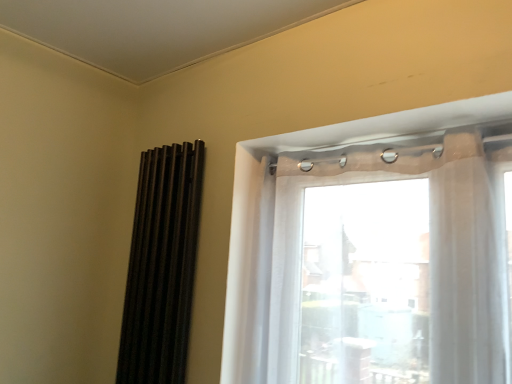
The image size is (512, 384). Describe the element at coordinates (389, 261) in the screenshot. I see `translucent fabric at upper right` at that location.

What are the coordinates of `translucent fabric at upper right` in the screenshot? It's located at (389, 261).

The image size is (512, 384). Describe the element at coordinates (162, 266) in the screenshot. I see `black matte shutters at left` at that location.

This screenshot has width=512, height=384. Identify the location of black matte shutters at left. (162, 266).

The image size is (512, 384). What are the coordinates of `translucent fabric at upper right` in the screenshot? It's located at (389, 261).

Can you confirm if translucent fabric at upper right is positioned to the right of black matte shutters at left?

Yes.

Relative to black matte shutters at left, is translucent fabric at upper right in front or behind?

translucent fabric at upper right is in front of black matte shutters at left.

Does point (280, 257) come in front of point (180, 215)?

Yes.

From the picture: From the image's perspective, who appears lower, translucent fabric at upper right or black matte shutters at left?

From the image's view, black matte shutters at left is below.

From a real-world perspective, is translucent fabric at upper right physically above black matte shutters at left?

Yes, from a real-world perspective, translucent fabric at upper right is on top of black matte shutters at left.

Which of these two, translucent fabric at upper right or black matte shutters at left, is wider?

Wider between the two is translucent fabric at upper right.

Does translucent fabric at upper right have a lesser height compared to black matte shutters at left?

Yes.

Considering the relative sizes of translucent fabric at upper right and black matte shutters at left in the image provided, is translucent fabric at upper right smaller than black matte shutters at left?

No.

Would you say translucent fabric at upper right contains black matte shutters at left?

No, black matte shutters at left is not inside translucent fabric at upper right.

Is translucent fabric at upper right far from black matte shutters at left?

translucent fabric at upper right is actually quite close to black matte shutters at left.

Is translucent fabric at upper right aimed at black matte shutters at left?

No, translucent fabric at upper right is not oriented towards black matte shutters at left.

Where is `window lying above the black matte shutters at left (from the image's perspective)`? window lying above the black matte shutters at left (from the image's perspective) is located at coordinates (389, 261).

Which object is positioned more to the right, black matte shutters at left or translucent fabric at upper right?

Positioned to the right is translucent fabric at upper right.

Does black matte shutters at left lie behind translucent fabric at upper right?

Yes, the depth of black matte shutters at left is greater than that of translucent fabric at upper right.

Does point (156, 292) lie in front of point (470, 275)?

No, (156, 292) is behind (470, 275).

From the image's perspective, does black matte shutters at left appear lower than translucent fabric at upper right?

Correct, black matte shutters at left appears lower than translucent fabric at upper right in the image.

From a real-world perspective, who is located higher, black matte shutters at left or translucent fabric at upper right?

From a 3D spatial view, translucent fabric at upper right is above.

Which of these two, black matte shutters at left or translucent fabric at upper right, is thinner?

black matte shutters at left is thinner.

In terms of height, does black matte shutters at left look taller or shorter compared to translucent fabric at upper right?

In the image, black matte shutters at left appears to be taller than translucent fabric at upper right.

Between black matte shutters at left and translucent fabric at upper right, which one has smaller size?

With smaller size is black matte shutters at left.

Could translucent fabric at upper right be considered to be inside black matte shutters at left?

That's incorrect, translucent fabric at upper right is not inside black matte shutters at left.

Are black matte shutters at left and translucent fabric at upper right far apart?

black matte shutters at left is actually quite close to translucent fabric at upper right.

Is black matte shutters at left aimed at translucent fabric at upper right?

No, black matte shutters at left is not facing towards translucent fabric at upper right.

The image size is (512, 384). What are the coordinates of `window above the black matte shutters at left (from the image's perspective)` in the screenshot? It's located at (389, 261).

Identify the location of window on the right of black matte shutters at left. (389, 261).

At what (x,y) coordinates should I click in order to perform the action: click on window in front of the black matte shutters at left. Please return your answer as a coordinate pair (x, y). This screenshot has width=512, height=384. Looking at the image, I should click on (389, 261).